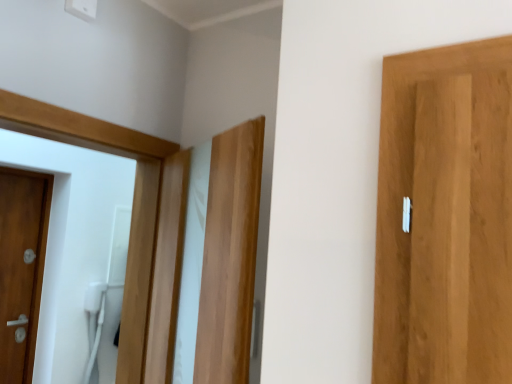
What do you see at coordinates (21, 268) in the screenshot? This screenshot has width=512, height=384. I see `matte brown door at left` at bounding box center [21, 268].

Locate an element on the screen. Image resolution: width=512 pixels, height=384 pixels. matte brown door at left is located at coordinates (21, 268).

In order to face matte brown door at left, should I rotate leftwards or rightwards?

You should look left and rotate roughly 30.105 degrees.

Where is `matte brown door at left`? The image size is (512, 384). matte brown door at left is located at coordinates (21, 268).